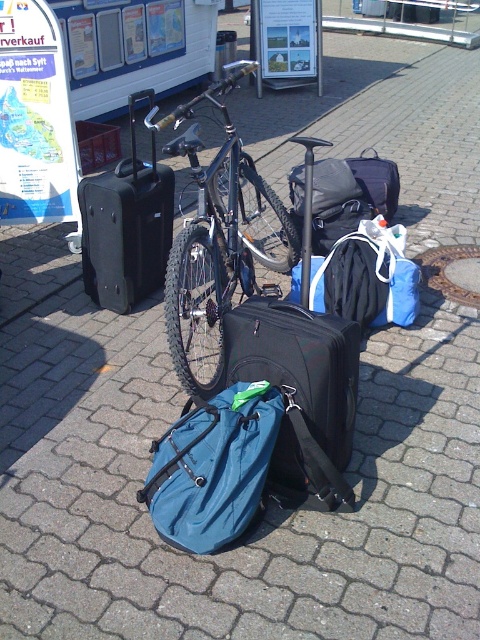
Question: Estimate the real-world distances between objects in this image. Which object is farther from the black hardshell suitcase at center?

Choices:
 (A) black matte suitcase at center
 (B) teal fabric backpack at center
 (C) shiny black bicycle at center

Answer: (B)

Question: Which point is closer to the camera?

Choices:
 (A) black hardshell suitcase at center
 (B) teal fabric backpack at center
 (C) black matte suitcase at center
 (D) shiny black bicycle at center

Answer: (B)

Question: Is black matte suitcase at center bigger than shiny black bicycle at center?

Choices:
 (A) yes
 (B) no

Answer: (B)

Question: Does black matte suitcase at center have a smaller size compared to shiny black bicycle at center?

Choices:
 (A) no
 (B) yes

Answer: (B)

Question: Can you confirm if black matte suitcase at center is positioned to the right of teal fabric backpack at center?

Choices:
 (A) yes
 (B) no

Answer: (A)

Question: Estimate the real-world distances between objects in this image. Which object is farther from the black matte suitcase at center?

Choices:
 (A) teal fabric backpack at center
 (B) shiny black bicycle at center
 (C) black hardshell suitcase at center

Answer: (C)